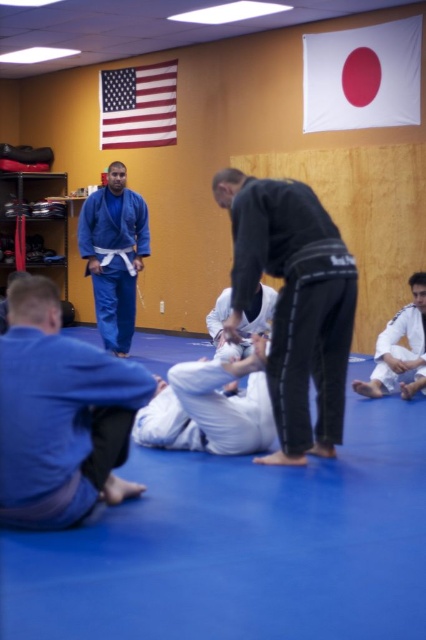
You are standing at the center of the dojo. You need to move to the blue matte gi at lower left. Which direction should you move in?

Since the blue matte gi at lower left is located at coordinates point 0.650 on the x axis and 0.143 on the y axis, you should move to the left and slightly forward to reach it.

Consider the image. You are a new student entering the dojo and see the blue matte gi at lower left and the black matte uniform at center. Which one has a smaller width?

The blue matte gi at lower left has a smaller width than the black matte uniform at center.